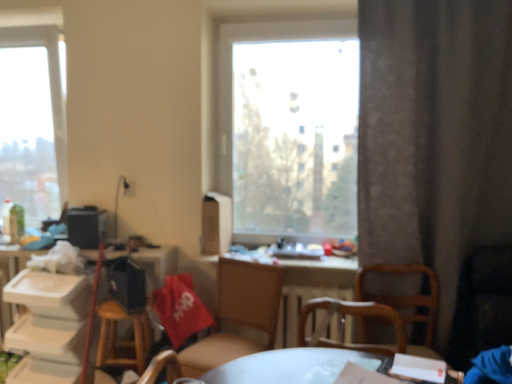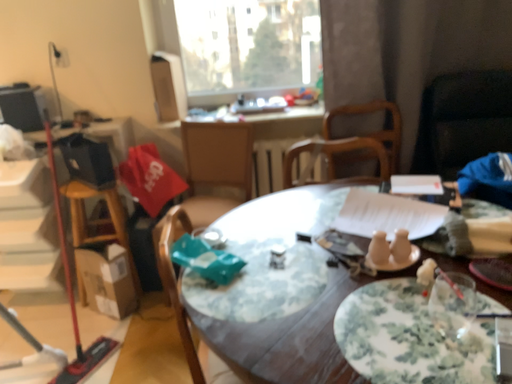
Question: How did the camera likely rotate when shooting the video?

Choices:
 (A) rotated upward
 (B) rotated downward

Answer: (B)